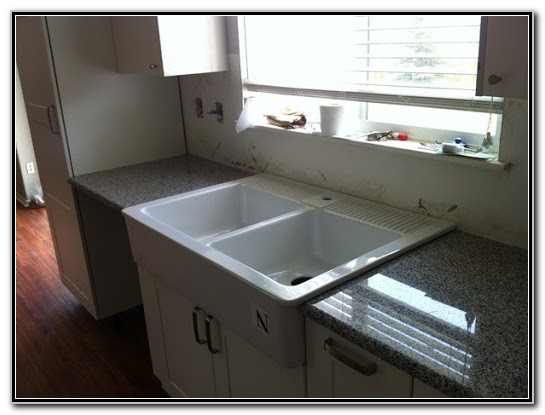
At what (x,y) coordinates should I click in order to perform the action: click on white sink. Please return your answer as a coordinate pair (x, y). The image size is (545, 415). Looking at the image, I should click on (314, 261).